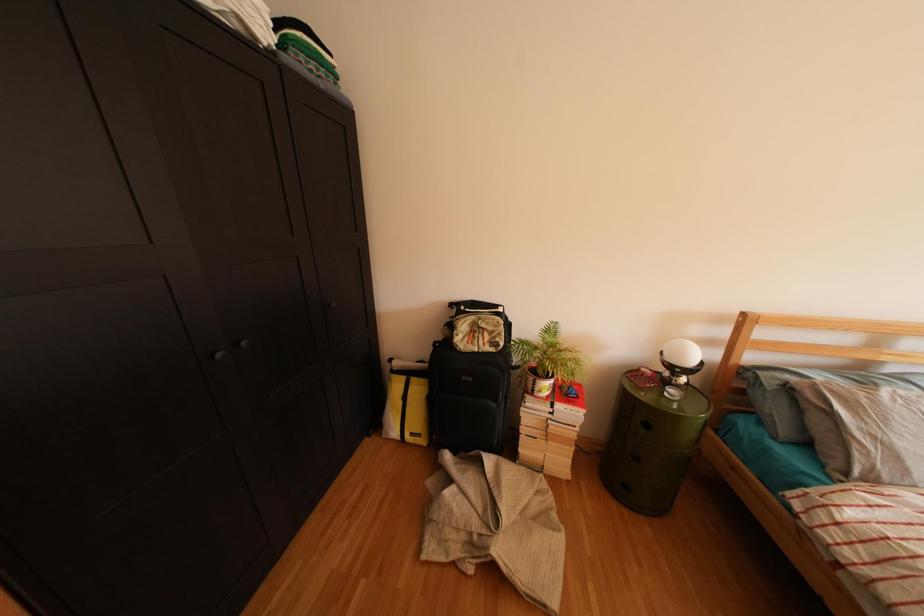
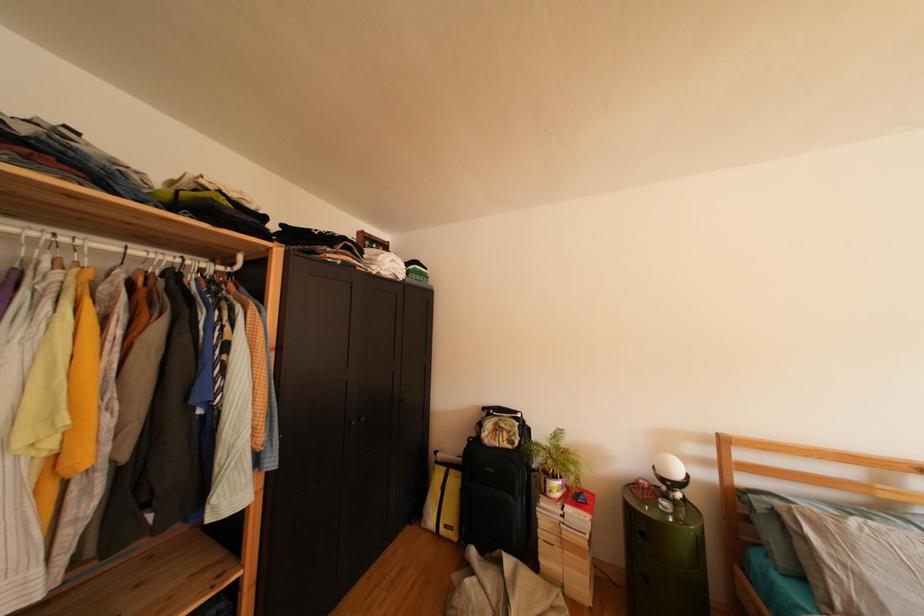
Question: Which direction would the cameraman need to move to produce the second image? Reply with the corresponding letter.

Choices:
 (A) Left
 (B) Right
 (C) Forward
 (D) Backward

Answer: (D)